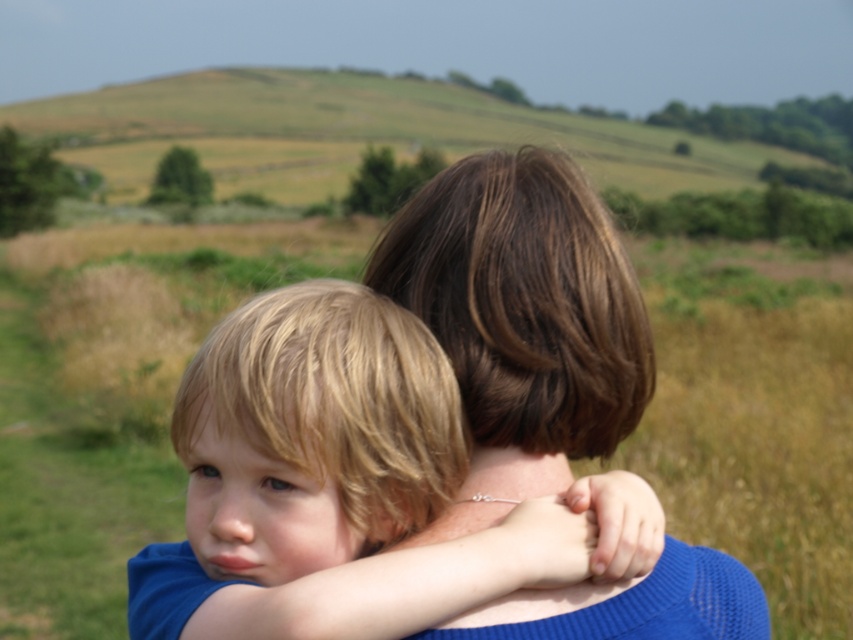
Question: Can you confirm if blonde hair at center is positioned above brown hair at center?

Choices:
 (A) no
 (B) yes

Answer: (A)

Question: Considering the relative positions of blonde hair at center and brown hair at center in the image provided, where is blonde hair at center located with respect to brown hair at center?

Choices:
 (A) above
 (B) below

Answer: (B)

Question: Which of the following is the farthest from the observer?

Choices:
 (A) blonde hair at center
 (B) brown hair at center

Answer: (B)

Question: Can you confirm if blonde hair at center is positioned to the right of brown hair at center?

Choices:
 (A) no
 (B) yes

Answer: (A)